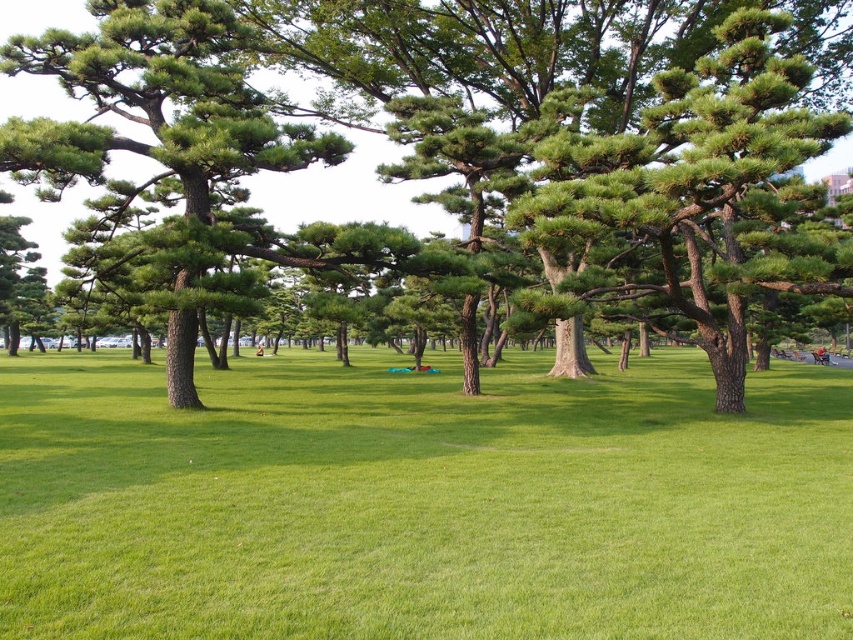
You are standing in the park and want to walk from the green grassy field at center to the green matte tree at center. Which direction should you move to reach the tree?

The green grassy field at center is positioned on the right side of green matte tree at center, so to reach the tree, you should move to the left from the green grassy field at center.

You are standing in the park and want to take a photo of the green textured tree at center. If your camera has a maximum focus range of 8 meters, will it be able to capture the tree clearly?

The green textured tree at center is 7.99 meters away from the viewer, so the camera can focus on it since the distance is within the 8 meters range.